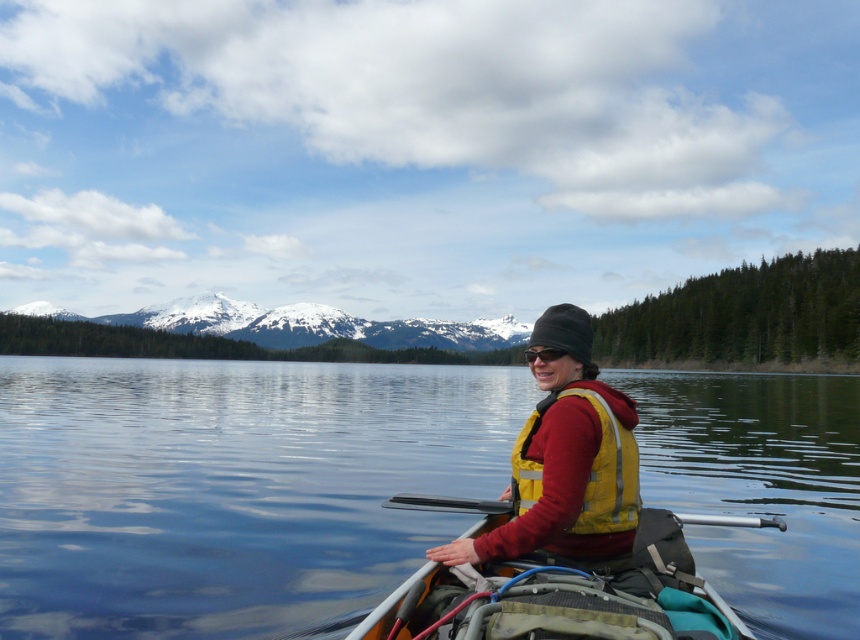
Question: Is yellow fabric canoe at center closer to the viewer compared to silver metallic paddle at center?

Choices:
 (A) no
 (B) yes

Answer: (B)

Question: Which point is farther to the camera?

Choices:
 (A) (587, 593)
 (B) (533, 484)

Answer: (B)

Question: Estimate the real-world distances between objects in this image. Which object is closer to the silver metallic paddle at center?

Choices:
 (A) yellow reflective life jacket at center
 (B) transparent water at center
 (C) yellow fabric canoe at center

Answer: (A)

Question: Is transparent water at center behind silver metallic paddle at center?

Choices:
 (A) yes
 (B) no

Answer: (A)

Question: Which of the following is the closest to the observer?

Choices:
 (A) yellow reflective life vest at center
 (B) yellow fabric canoe at center
 (C) transparent water at center
 (D) silver metallic paddle at center

Answer: (B)

Question: Is transparent water at center positioned at the back of yellow reflective life jacket at center?

Choices:
 (A) no
 (B) yes

Answer: (B)